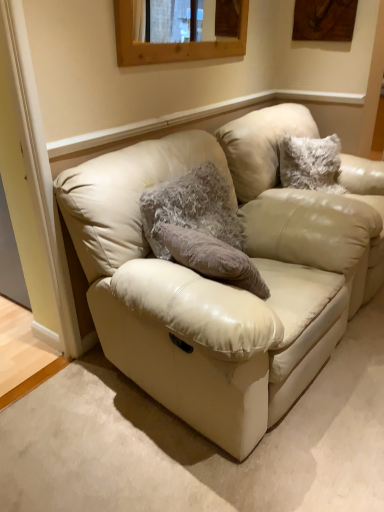
Question: From the image's perspective, is beige leather swivel chair at center over wooden frame at upper center?

Choices:
 (A) no
 (B) yes

Answer: (A)

Question: Is beige leather swivel chair at center taller than wooden frame at upper center?

Choices:
 (A) yes
 (B) no

Answer: (A)

Question: Is beige leather swivel chair at center facing towards wooden frame at upper center?

Choices:
 (A) yes
 (B) no

Answer: (B)

Question: Is beige leather swivel chair at center in contact with wooden frame at upper center?

Choices:
 (A) yes
 (B) no

Answer: (B)

Question: Is beige leather swivel chair at center to the right of wooden frame at upper center from the viewer's perspective?

Choices:
 (A) no
 (B) yes

Answer: (B)

Question: Would you consider beige leather swivel chair at center to be distant from wooden frame at upper center?

Choices:
 (A) no
 (B) yes

Answer: (A)

Question: Is fuzzy gray pillow at center in contact with beige leather couch at center?

Choices:
 (A) yes
 (B) no

Answer: (B)

Question: Is fuzzy gray pillow at center thinner than beige leather couch at center?

Choices:
 (A) yes
 (B) no

Answer: (A)

Question: Considering the relative sizes of fuzzy gray pillow at center and beige leather couch at center in the image provided, is fuzzy gray pillow at center smaller than beige leather couch at center?

Choices:
 (A) no
 (B) yes

Answer: (B)

Question: Can we say fuzzy gray pillow at center lies outside beige leather couch at center?

Choices:
 (A) yes
 (B) no

Answer: (B)

Question: Can you confirm if fuzzy gray pillow at center is bigger than beige leather couch at center?

Choices:
 (A) yes
 (B) no

Answer: (B)

Question: From a real-world perspective, is fuzzy gray pillow at center physically above beige leather couch at center?

Choices:
 (A) no
 (B) yes

Answer: (B)

Question: Is beige leather swivel chair at center oriented towards beige leather couch at center?

Choices:
 (A) no
 (B) yes

Answer: (A)